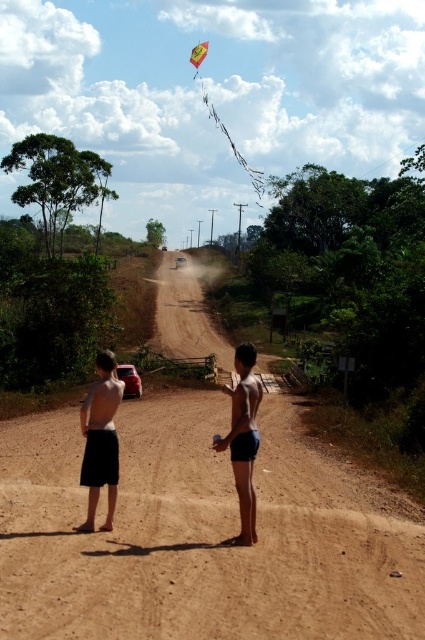
Question: From the image, what is the correct spatial relationship of dark blue shorts at center in relation to smooth blue shorts at center?

Choices:
 (A) left
 (B) right

Answer: (A)

Question: Is dark blue shorts at center to the left of yellow fabric kite at upper center from the viewer's perspective?

Choices:
 (A) yes
 (B) no

Answer: (B)

Question: Can you confirm if dark blue shorts at center is positioned to the left of yellow fabric kite at upper center?

Choices:
 (A) yes
 (B) no

Answer: (B)

Question: Among these objects, which one is nearest to the camera?

Choices:
 (A) yellow fabric kite at upper center
 (B) black shorts at center
 (C) dark blue shorts at center
 (D) smooth blue shorts at center

Answer: (C)

Question: Which object is the farthest from the black shorts at center?

Choices:
 (A) yellow fabric kite at upper center
 (B) dark blue shorts at center
 (C) smooth blue shorts at center

Answer: (A)

Question: Which object appears farthest from the camera in this image?

Choices:
 (A) yellow fabric kite at upper center
 (B) black shorts at center
 (C) dark blue shorts at center
 (D) smooth blue shorts at center

Answer: (A)